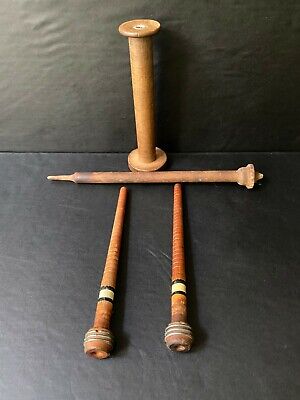
What are the coordinates of `peg` in the screenshot? It's located at (210, 178).